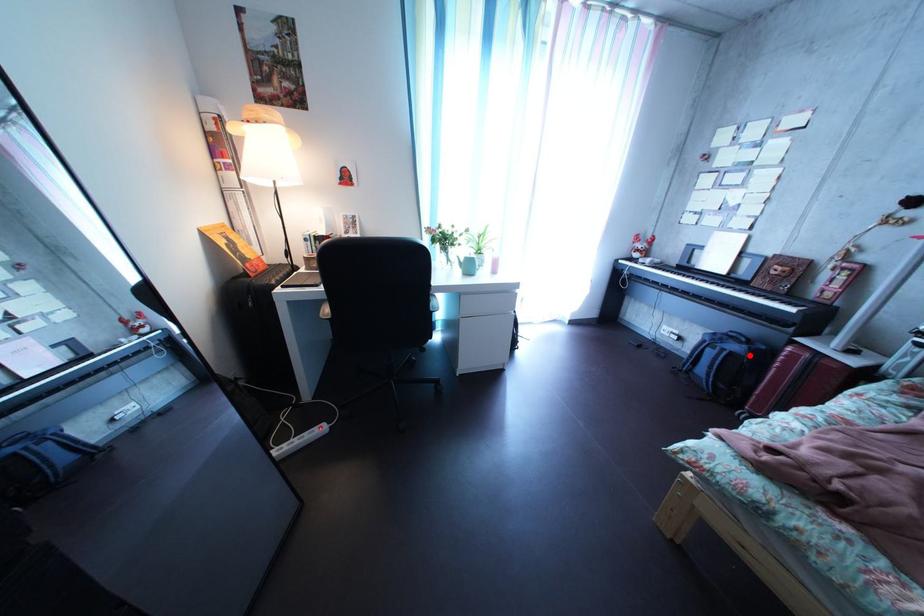
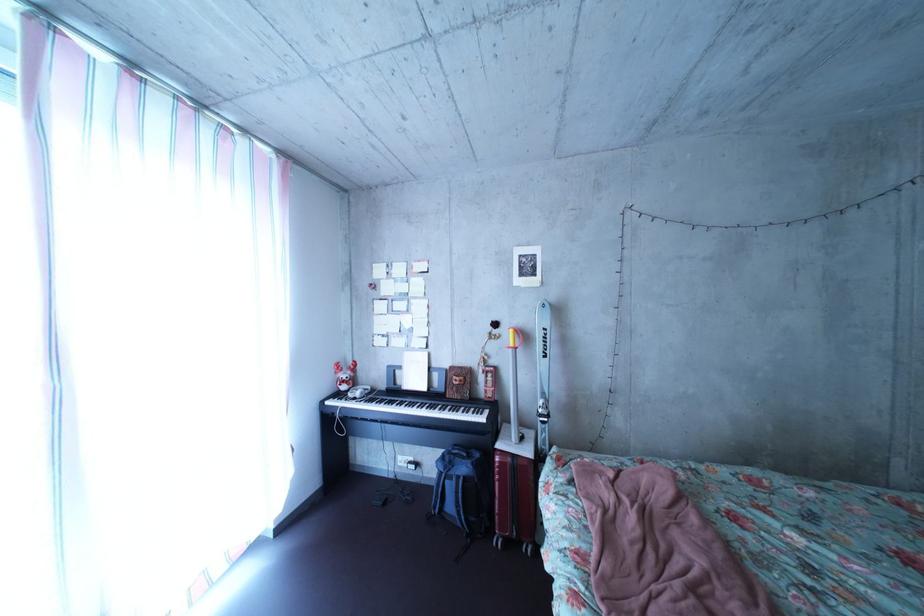
In the second image, find the point that corresponds to the highlighted location in the first image.

(479, 477)